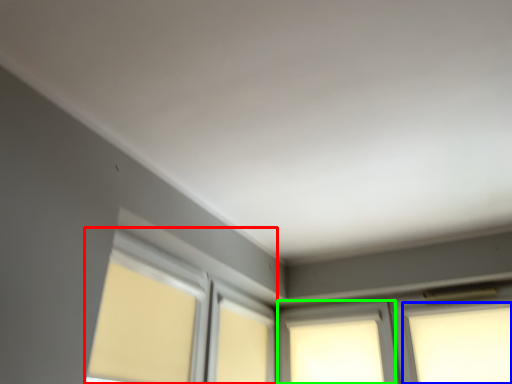
Question: Estimate the real-world distances between objects in this image. Which object is closer to bay window (highlighted by a red box), window (highlighted by a blue box) or window (highlighted by a green box)?

Choices:
 (A) window
 (B) window

Answer: (B)